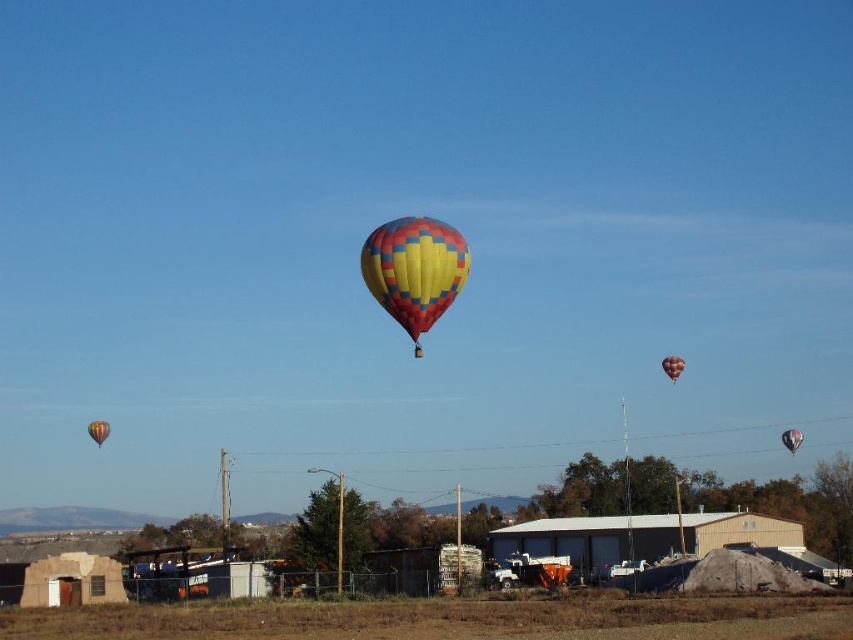
Which is in front, point (440, 291) or point (675, 356)?

Point (440, 291)

Is multicolored fabric hot air balloon at center wider than multicolored fabric hot air balloon at upper center?

No.

Who is more forward, (402, 314) or (668, 364)?

Positioned in front is point (402, 314).

Locate an element on the screen. This screenshot has height=640, width=853. multicolored fabric hot air balloon at center is located at coordinates (415, 269).

Image resolution: width=853 pixels, height=640 pixels. Describe the element at coordinates (672, 365) in the screenshot. I see `multicolored fabric hot air balloon at upper center` at that location.

Can you confirm if multicolored fabric hot air balloon at upper center is smaller than multicolored fabric balloon at center?

Indeed, multicolored fabric hot air balloon at upper center has a smaller size compared to multicolored fabric balloon at center.

Does point (669, 368) lie behind point (786, 429)?

That is False.

Where is `multicolored fabric hot air balloon at upper center`? The height and width of the screenshot is (640, 853). multicolored fabric hot air balloon at upper center is located at coordinates (672, 365).

Is multicolored fabric hot air balloon at center taller than multicolored fabric balloon at center?

In fact, multicolored fabric hot air balloon at center may be shorter than multicolored fabric balloon at center.

Who is higher up, multicolored fabric hot air balloon at center or multicolored fabric balloon at center?

multicolored fabric hot air balloon at center is above.

Describe the element at coordinates (415, 269) in the screenshot. Image resolution: width=853 pixels, height=640 pixels. I see `multicolored fabric hot air balloon at center` at that location.

Locate an element on the screen. multicolored fabric hot air balloon at center is located at coordinates (415, 269).